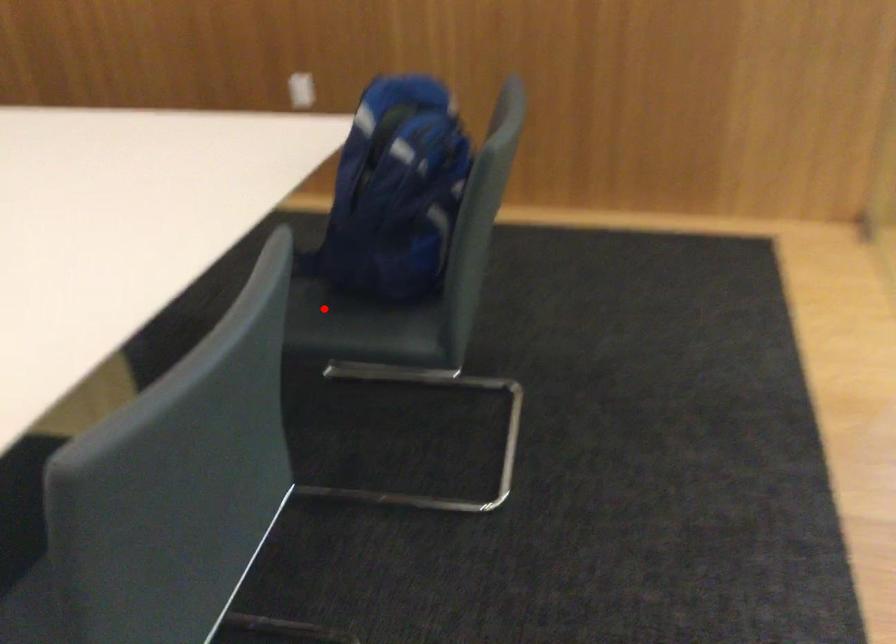
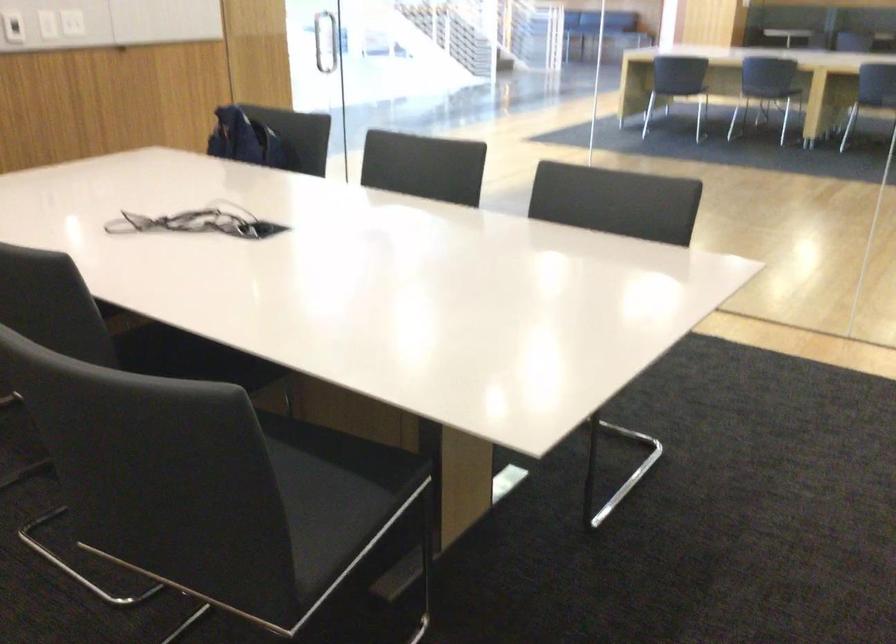
Question: I am providing you with two images of the same scene from different viewpoints. A red point is marked on the first image. Is the red point's position out of view in image 2?

Choices:
 (A) Yes
 (B) No

Answer: (A)